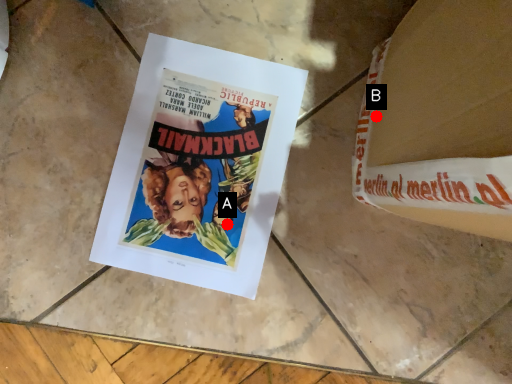
Question: Two points are circled on the image, labeled by A and B beside each circle. Which point is further to the camera?

Choices:
 (A) A is further
 (B) B is further

Answer: (A)